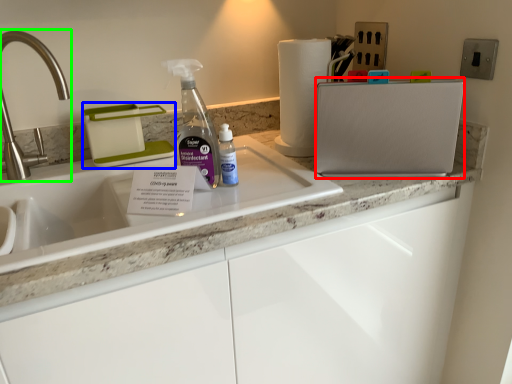
Question: Which is farther away from appliance (highlighted by a red box)? appliance (highlighted by a blue box) or tap (highlighted by a green box)?

Choices:
 (A) appliance
 (B) tap

Answer: (B)